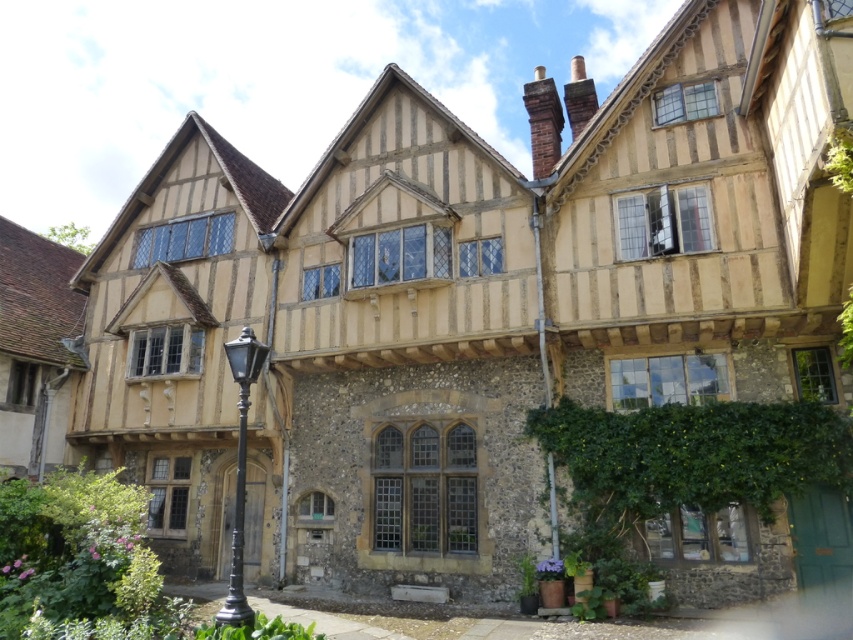
Question: Which object is closer to the camera taking this photo?

Choices:
 (A) metallic pole at right
 (B) green leafy ivy at lower right
 (C) black polished metal lamp post at lower left

Answer: (C)

Question: Which object is farther from the camera taking this photo?

Choices:
 (A) green leafy ivy at lower right
 (B) black polished metal lamp post at lower left

Answer: (A)

Question: Does green leafy ivy at lower right have a larger size compared to metallic pole at right?

Choices:
 (A) no
 (B) yes

Answer: (B)

Question: Which of the following is the farthest from the observer?

Choices:
 (A) (241, 419)
 (B) (540, 339)
 (C) (639, 500)

Answer: (A)

Question: Does black polished metal lamp post at lower left have a larger size compared to metallic pole at right?

Choices:
 (A) yes
 (B) no

Answer: (A)

Question: Is green leafy ivy at lower right above metallic pole at right?

Choices:
 (A) yes
 (B) no

Answer: (A)